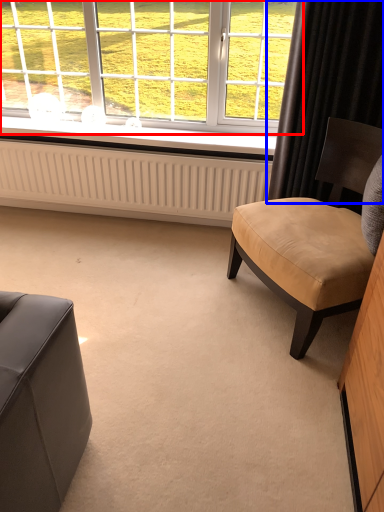
Question: Which of the following is the closest to the observer, window (highlighted by a red box) or curtain (highlighted by a blue box)?

Choices:
 (A) window
 (B) curtain

Answer: (B)